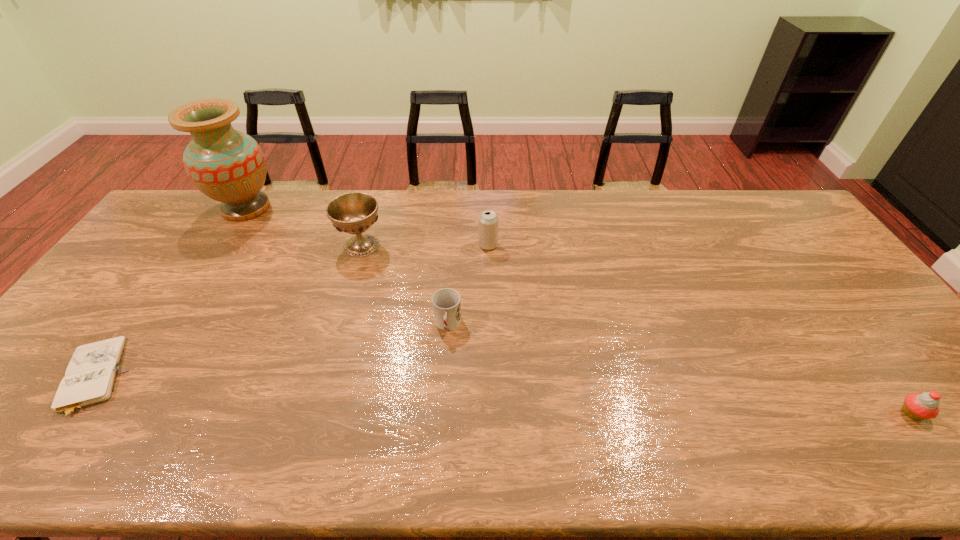
This screenshot has width=960, height=540. I want to click on vacant area that lies between the rightmost object and the second object from right to left, so click(x=700, y=329).

What are the coordinates of `vacant space that is in between the second object from right to left and the notebook` in the screenshot? It's located at (290, 312).

Locate an element on the screen. This screenshot has width=960, height=540. blank region between the cup and the farthest object is located at coordinates (347, 266).

Choose which object is the nearest neighbor to the farthest object. Please provide its 2D coordinates. Your answer should be formatted as a tuple, i.e. [(x, y)], where the tuple contains the x and y coordinates of a point satisfying the conditions above.

[(353, 213)]

Select which object is the third closest to the shortest object. Please provide its 2D coordinates. Your answer should be formatted as a tuple, i.e. [(x, y)], where the tuple contains the x and y coordinates of a point satisfying the conditions above.

[(446, 303)]

In order to click on blank area in the image that satisfies the following two spatial constraints: 1. on the handle side of the fourth object from left to right; 2. on the right side of the cupcake in this screenshot , I will do `click(442, 413)`.

Locate an element on the screen. The width and height of the screenshot is (960, 540). vacant space that satisfies the following two spatial constraints: 1. on the front side of the cupcake; 2. on the right side of the beer can is located at coordinates (492, 413).

Identify the location of vacant position in the image that satisfies the following two spatial constraints: 1. on the front side of the tallest object; 2. on the left side of the fourth shortest object. Image resolution: width=960 pixels, height=540 pixels. (223, 245).